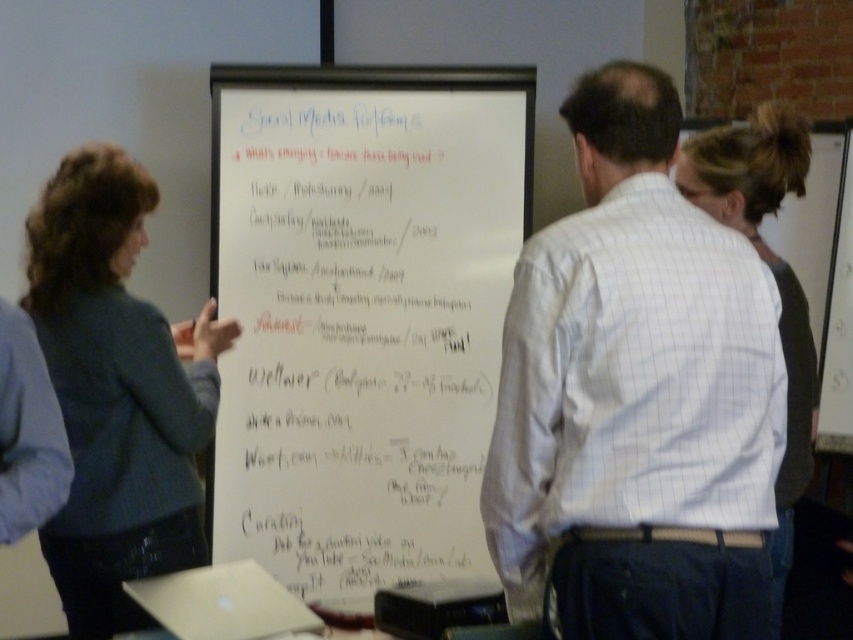
Is whiteboard at center taller than white checkered shirt at center?

Correct, whiteboard at center is much taller as white checkered shirt at center.

Between whiteboard at center and white checkered shirt at center, which one is positioned higher?

whiteboard at center is higher up.

Which is behind, point (366, 342) or point (699, 516)?

Positioned behind is point (366, 342).

At what (x,y) coordinates should I click in order to perform the action: click on whiteboard at center. Please return your answer as a coordinate pair (x, y). Image resolution: width=853 pixels, height=640 pixels. Looking at the image, I should click on (361, 314).

Which of these two, white checkered shirt at center or dark brown hair at upper right, stands taller?

dark brown hair at upper right is taller.

Who is more distant from viewer, (740, 588) or (764, 211)?

Point (764, 211)

Where is `white checkered shirt at center`? The image size is (853, 640). white checkered shirt at center is located at coordinates (637, 394).

Does white checkered shirt at center appear under dark blue sweater at left?

No, white checkered shirt at center is not below dark blue sweater at left.

Is the position of white checkered shirt at center less distant than that of dark blue sweater at left?

Yes, white checkered shirt at center is in front of dark blue sweater at left.

At what (x,y) coordinates should I click in order to perform the action: click on white checkered shirt at center. Please return your answer as a coordinate pair (x, y). Looking at the image, I should click on (637, 394).

The image size is (853, 640). I want to click on white checkered shirt at center, so click(637, 394).